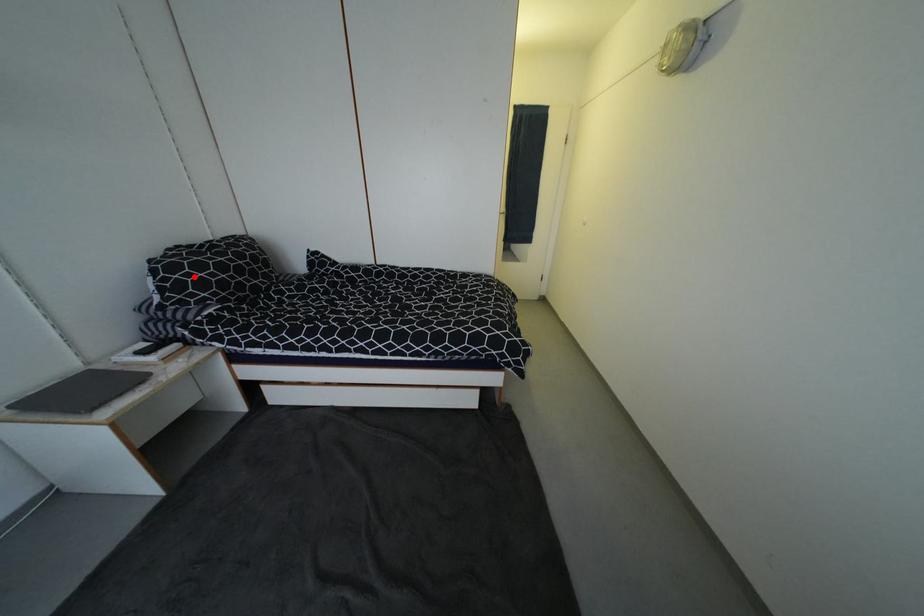
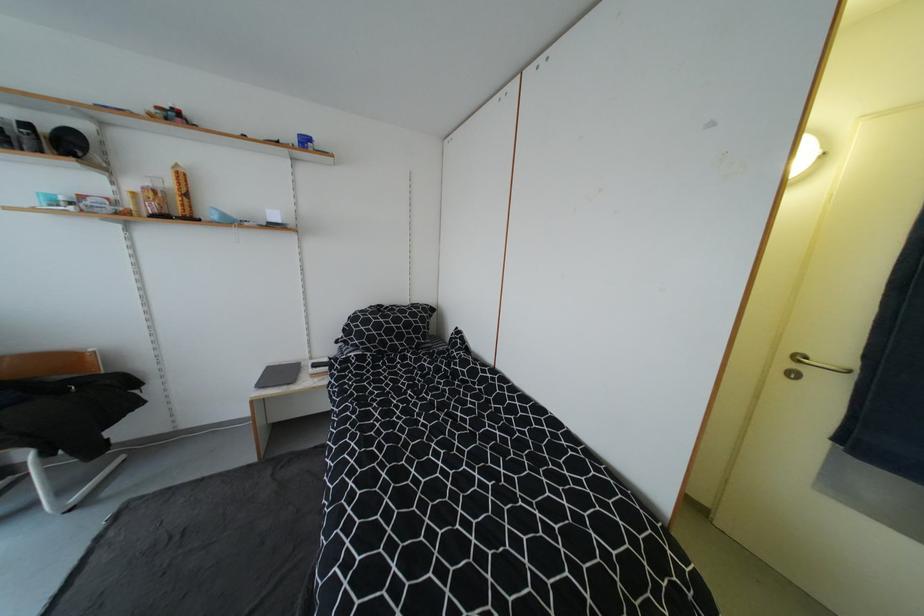
Locate, in the second image, the point that corresponds to the highlighted location in the first image.

(362, 328)